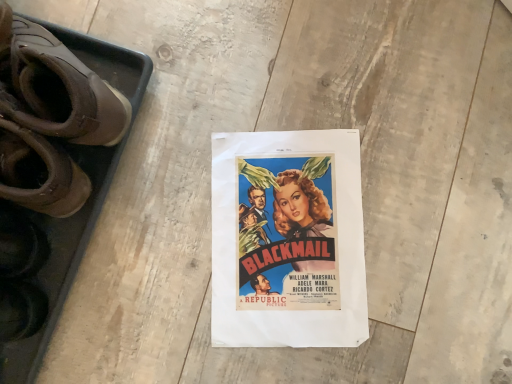
Question: Is vivid paper poster at center inside or outside of brown leather shoes at left?

Choices:
 (A) inside
 (B) outside

Answer: (B)

Question: From their relative heights in the image, would you say vivid paper poster at center is taller or shorter than brown leather shoes at left?

Choices:
 (A) tall
 (B) short

Answer: (B)

Question: Considering the positions of point (330, 302) and point (76, 76), is point (330, 302) closer or farther from the camera than point (76, 76)?

Choices:
 (A) farther
 (B) closer

Answer: (A)

Question: Would you say brown leather shoes at left is to the left or to the right of vivid paper poster at center in the picture?

Choices:
 (A) right
 (B) left

Answer: (B)

Question: Considering the positions of brown leather shoes at left and vivid paper poster at center in the image, is brown leather shoes at left taller or shorter than vivid paper poster at center?

Choices:
 (A) tall
 (B) short

Answer: (A)

Question: Is brown leather shoes at left inside the boundaries of vivid paper poster at center, or outside?

Choices:
 (A) inside
 (B) outside

Answer: (B)

Question: From the image's perspective, is brown leather shoes at left positioned above or below vivid paper poster at center?

Choices:
 (A) below
 (B) above

Answer: (B)